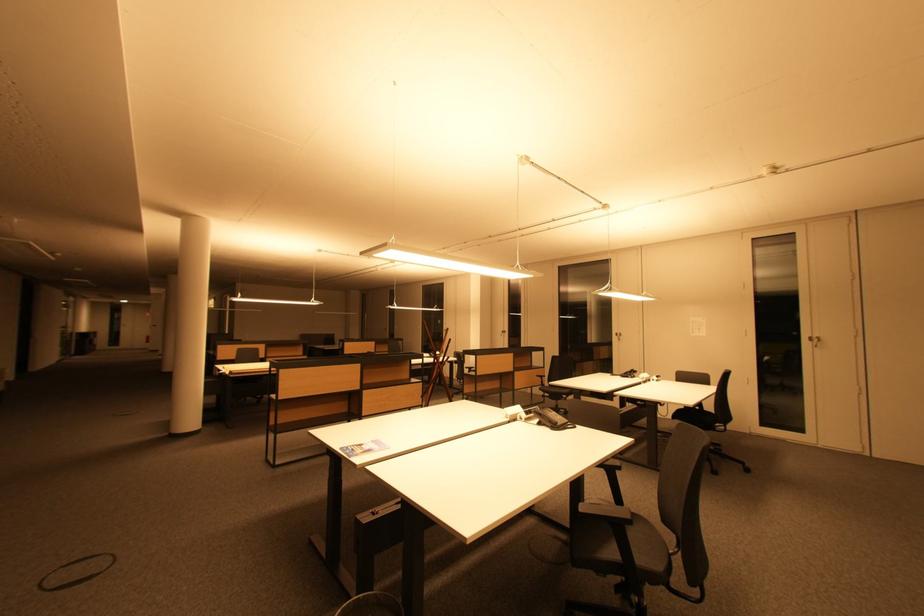
Image resolution: width=924 pixels, height=616 pixels. In order to click on silver door handle in this screenshot , I will do point(816,341).